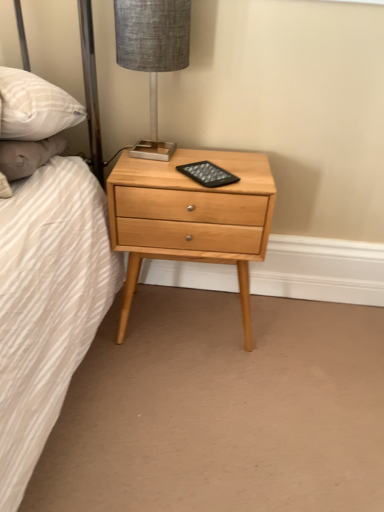
Question: Should I look upward or downward to see textured gray fabric lampshade at upper center?

Choices:
 (A) down
 (B) up

Answer: (B)

Question: From a real-world perspective, does natural wood nightstand at center sit lower than textured gray fabric lampshade at upper center?

Choices:
 (A) no
 (B) yes

Answer: (B)

Question: Is natural wood nightstand at center bigger than textured gray fabric lampshade at upper center?

Choices:
 (A) no
 (B) yes

Answer: (B)

Question: Is natural wood nightstand at center not near textured gray fabric lampshade at upper center?

Choices:
 (A) no
 (B) yes

Answer: (A)

Question: Does natural wood nightstand at center lie in front of textured gray fabric lampshade at upper center?

Choices:
 (A) yes
 (B) no

Answer: (B)

Question: Does natural wood nightstand at center have a smaller size compared to textured gray fabric lampshade at upper center?

Choices:
 (A) no
 (B) yes

Answer: (A)

Question: Can you confirm if natural wood nightstand at center is thinner than textured gray fabric lampshade at upper center?

Choices:
 (A) no
 (B) yes

Answer: (A)

Question: Does textured gray fabric lampshade at upper center have a lesser width compared to natural wood nightstand at center?

Choices:
 (A) yes
 (B) no

Answer: (A)

Question: Is textured gray fabric lampshade at upper center positioned with its back to natural wood nightstand at center?

Choices:
 (A) yes
 (B) no

Answer: (B)

Question: Is textured gray fabric lampshade at upper center facing towards natural wood nightstand at center?

Choices:
 (A) yes
 (B) no

Answer: (B)

Question: Does textured gray fabric lampshade at upper center appear on the left side of natural wood nightstand at center?

Choices:
 (A) no
 (B) yes

Answer: (B)

Question: From the image's perspective, is textured gray fabric lampshade at upper center located beneath natural wood nightstand at center?

Choices:
 (A) yes
 (B) no

Answer: (B)

Question: Is textured gray fabric lampshade at upper center completely or partially outside of natural wood nightstand at center?

Choices:
 (A) yes
 (B) no

Answer: (A)

Question: Is natural wood nightstand at center taller or shorter than textured gray fabric lampshade at upper center?

Choices:
 (A) short
 (B) tall

Answer: (B)